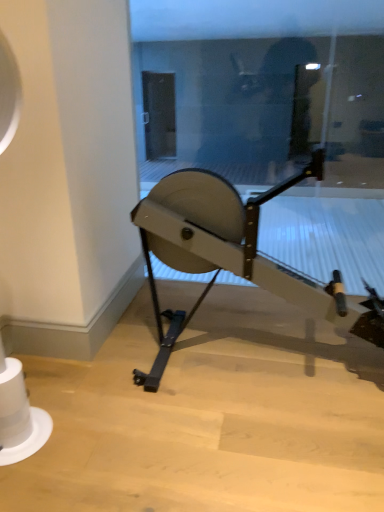
Measure the distance between point (277, 293) and camera.

The distance of point (277, 293) from camera is 1.80 meters.

Describe the element at coordinates (233, 254) in the screenshot. I see `metallic silver exercise bike at center` at that location.

At what (x,y) coordinates should I click in order to perform the action: click on metallic silver exercise bike at center. Please return your answer as a coordinate pair (x, y). This screenshot has height=512, width=384. Looking at the image, I should click on (233, 254).

Identify the location of metallic silver exercise bike at center. This screenshot has height=512, width=384. (233, 254).